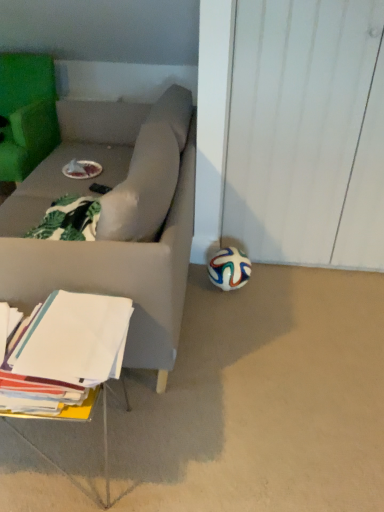
Question: Is white matte soccer ball at lower right in front of multicolored rubber ball at lower right?

Choices:
 (A) yes
 (B) no

Answer: (A)

Question: Can you confirm if white matte soccer ball at lower right is thinner than multicolored rubber ball at lower right?

Choices:
 (A) yes
 (B) no

Answer: (B)

Question: Does white matte soccer ball at lower right come behind multicolored rubber ball at lower right?

Choices:
 (A) yes
 (B) no

Answer: (B)

Question: Is the surface of white matte soccer ball at lower right in direct contact with multicolored rubber ball at lower right?

Choices:
 (A) no
 (B) yes

Answer: (A)

Question: Is white matte soccer ball at lower right far away from multicolored rubber ball at lower right?

Choices:
 (A) yes
 (B) no

Answer: (B)

Question: Can you confirm if white matte soccer ball at lower right is taller than multicolored rubber ball at lower right?

Choices:
 (A) yes
 (B) no

Answer: (B)

Question: Is green fabric chair at upper left thinner than multicolored rubber ball at lower right?

Choices:
 (A) yes
 (B) no

Answer: (B)

Question: Could you tell me if green fabric chair at upper left is facing multicolored rubber ball at lower right?

Choices:
 (A) no
 (B) yes

Answer: (A)

Question: Is green fabric chair at upper left wider than multicolored rubber ball at lower right?

Choices:
 (A) yes
 (B) no

Answer: (A)

Question: Can you confirm if green fabric chair at upper left is smaller than multicolored rubber ball at lower right?

Choices:
 (A) yes
 (B) no

Answer: (B)

Question: Can you see green fabric chair at upper left touching multicolored rubber ball at lower right?

Choices:
 (A) yes
 (B) no

Answer: (B)

Question: Does green fabric chair at upper left have a greater height compared to multicolored rubber ball at lower right?

Choices:
 (A) no
 (B) yes

Answer: (B)

Question: Is multicolored rubber ball at lower right with white paper at lower left?

Choices:
 (A) no
 (B) yes

Answer: (A)